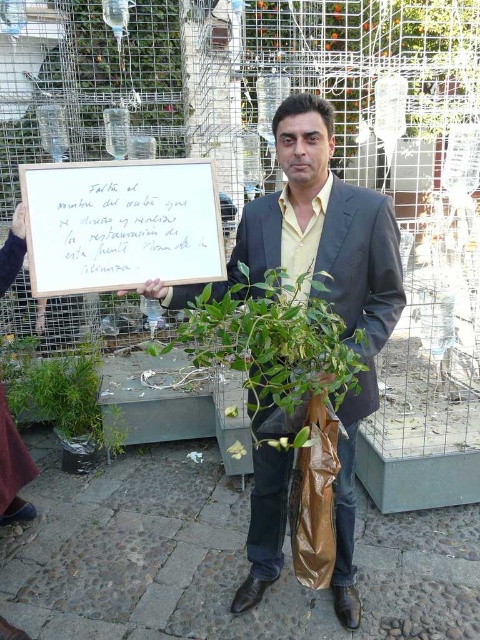
You are a delivery person who needs to place a package that is 12 inches long. You see the matte black suit at center and the brown plastic bag at center. Can you fit the package between them?

The distance between the matte black suit at center and the brown plastic bag at center is 10.55 inches. Since the package is 12 inches long, it cannot fit between them as the space is shorter than the package.